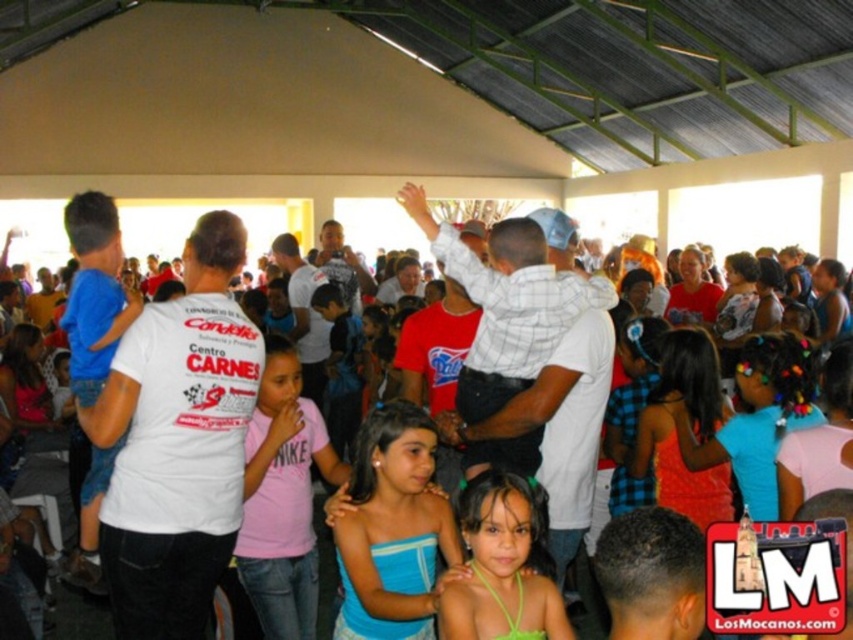
Does blue fabric dress at center have a larger size compared to pink cotton shirt at center?

Correct, blue fabric dress at center is larger in size than pink cotton shirt at center.

Who is shorter, blue fabric dress at center or pink cotton shirt at center?

Standing shorter between the two is blue fabric dress at center.

Does point (422, 468) come in front of point (257, 458)?

Yes, point (422, 468) is closer to viewer.

Where is `blue fabric dress at center`? The image size is (853, 640). blue fabric dress at center is located at coordinates tap(392, 529).

Is pink cotton shirt at center to the left of green fabric dress at center from the viewer's perspective?

Indeed, pink cotton shirt at center is positioned on the left side of green fabric dress at center.

Who is more forward, (248, 532) or (514, 484)?

Point (514, 484) is in front.

Who is more forward, (291, 420) or (490, 573)?

Point (490, 573) is in front.

Where is `pink cotton shirt at center`? pink cotton shirt at center is located at coordinates (282, 499).

Looking at this image, is pink cotton shirt at center taller than white cotton shirt at center?

Indeed, pink cotton shirt at center has a greater height compared to white cotton shirt at center.

Which is above, pink cotton shirt at center or white cotton shirt at center?

Positioned higher is pink cotton shirt at center.

Is point (334, 483) positioned before point (328, 589)?

Yes, it is.

Locate an element on the screen. pink cotton shirt at center is located at coordinates (282, 499).